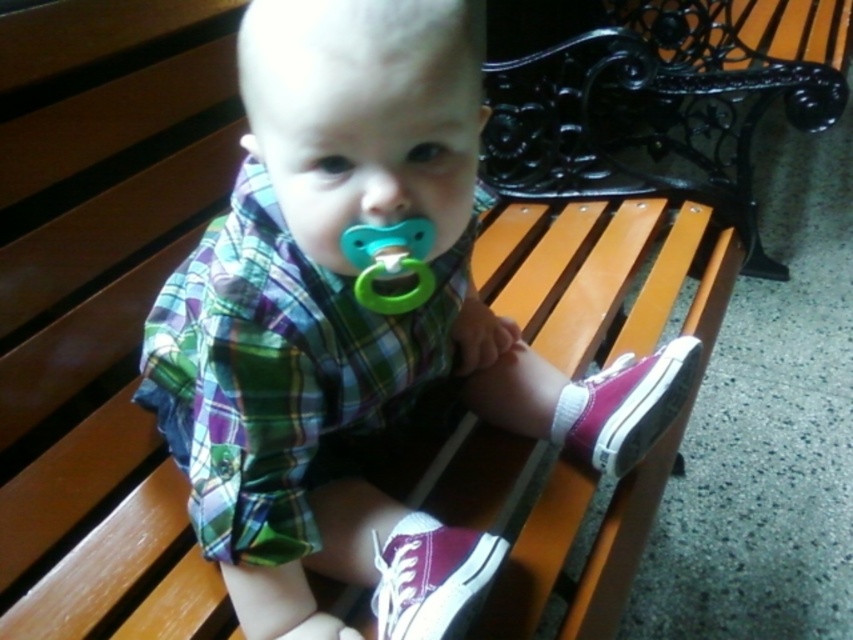
You are standing in front of a baby sitting on a wooden bench. The baby is wearing a plaid shirt and has a pacifier. There is a point marked at coordinates (357, 326). According to the image, what does this point indicate?

The point at coordinates (357, 326) marks the plaid fabric shirt at center.